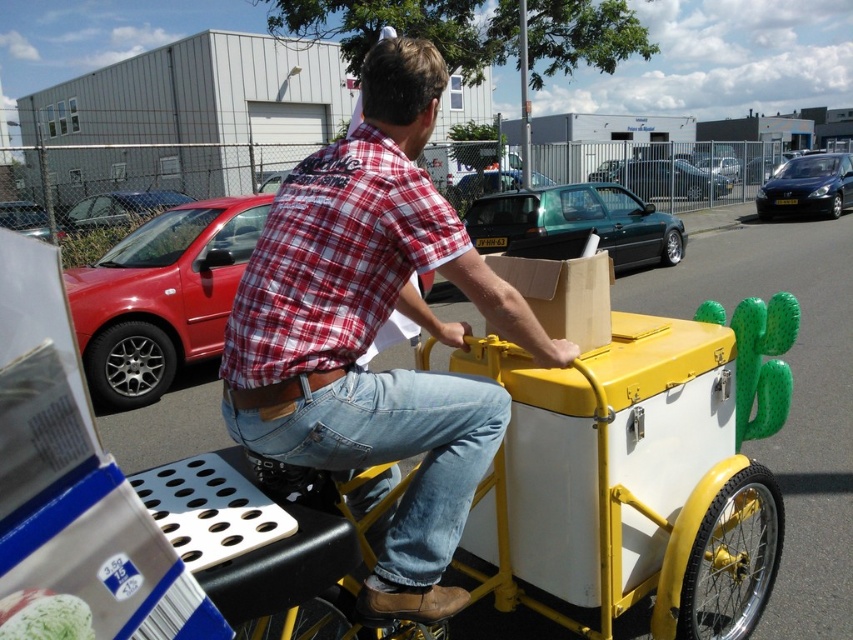
Question: Which point appears closest to the camera in this image?

Choices:
 (A) (837, 168)
 (B) (374, 412)
 (C) (94, 204)
 (D) (480, 237)

Answer: (B)

Question: Among these objects, which one is nearest to the camera?

Choices:
 (A) matte red car at left
 (B) matte red plaid shirt at center

Answer: (B)

Question: Can you confirm if matte red car at left is positioned below metallic red car at left?

Choices:
 (A) yes
 (B) no

Answer: (A)

Question: Is matte red plaid shirt at center smaller than metallic blue car at right?

Choices:
 (A) yes
 (B) no

Answer: (B)

Question: Among these points, which one is nearest to the camera?

Choices:
 (A) (624, 208)
 (B) (126, 301)
 (C) (183, 198)

Answer: (B)

Question: In this image, where is matte red plaid shirt at center located relative to metallic blue car at right?

Choices:
 (A) left
 (B) right

Answer: (A)